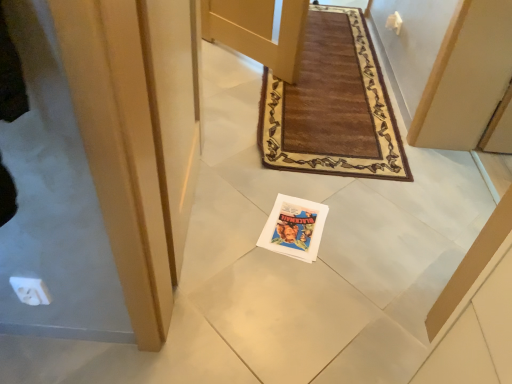
Question: Is matte paper magazine at center facing towards matte wood door at center?

Choices:
 (A) yes
 (B) no

Answer: (B)

Question: From the image's perspective, is matte paper magazine at center on matte wood door at center?

Choices:
 (A) no
 (B) yes

Answer: (A)

Question: Are matte paper magazine at center and matte wood door at center beside each other?

Choices:
 (A) yes
 (B) no

Answer: (B)

Question: Is matte paper magazine at center at the right side of matte wood door at center?

Choices:
 (A) yes
 (B) no

Answer: (B)

Question: Does matte paper magazine at center come in front of matte wood door at center?

Choices:
 (A) no
 (B) yes

Answer: (A)

Question: Can you confirm if matte paper magazine at center is taller than matte wood door at center?

Choices:
 (A) yes
 (B) no

Answer: (B)

Question: Can you confirm if matte wood door at center is bigger than matte paper magazine at center?

Choices:
 (A) yes
 (B) no

Answer: (A)

Question: From the image's perspective, is matte wood door at center below matte paper magazine at center?

Choices:
 (A) no
 (B) yes

Answer: (A)

Question: From a real-world perspective, does matte wood door at center stand above matte paper magazine at center?

Choices:
 (A) yes
 (B) no

Answer: (A)

Question: Is matte wood door at center outside matte paper magazine at center?

Choices:
 (A) no
 (B) yes

Answer: (B)

Question: Does matte wood door at center turn towards matte paper magazine at center?

Choices:
 (A) yes
 (B) no

Answer: (A)

Question: Can you see matte wood door at center touching matte paper magazine at center?

Choices:
 (A) no
 (B) yes

Answer: (A)

Question: Is matte paper magazine at center situated inside matte wood door at center or outside?

Choices:
 (A) outside
 (B) inside

Answer: (A)